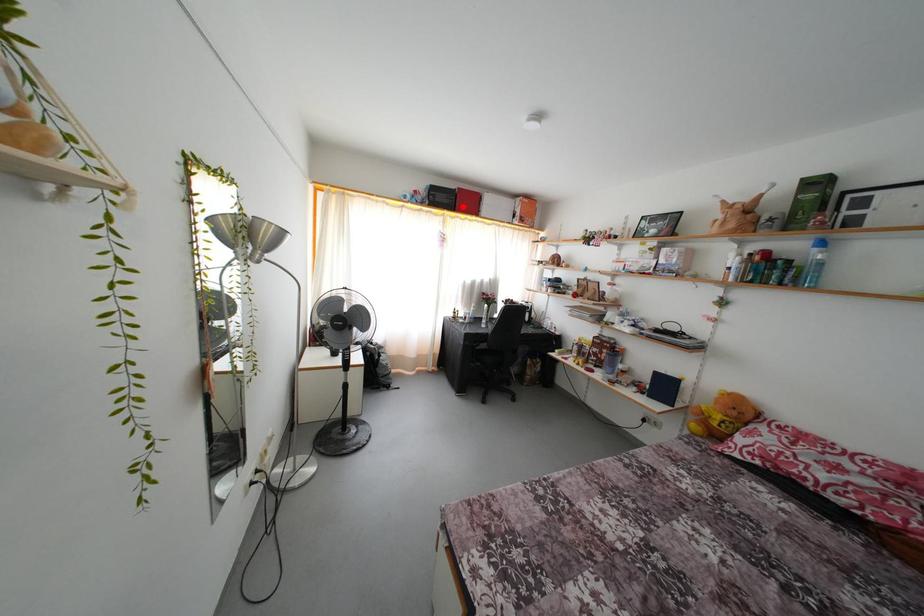
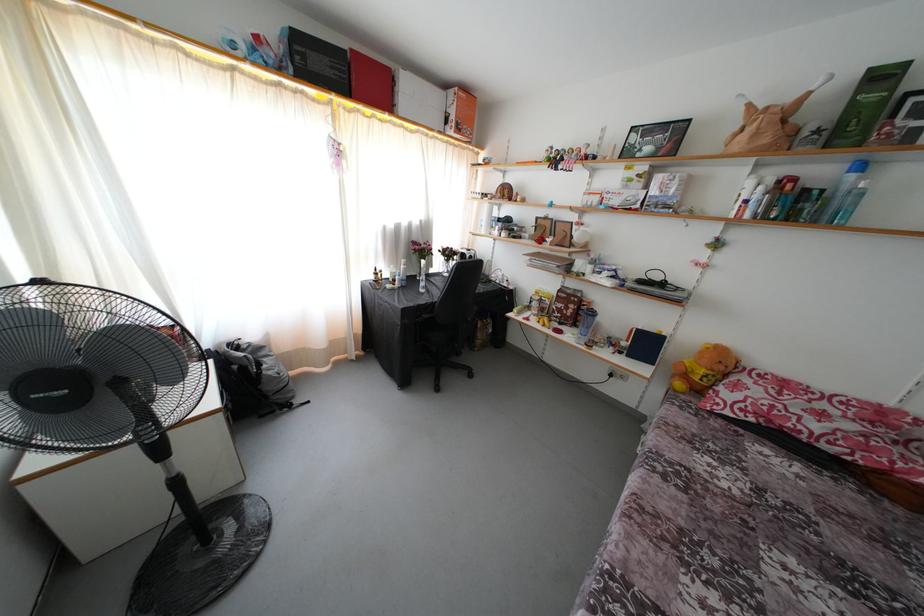
The point at the highlighted location is marked in the first image. Where is the corresponding point in the second image?

(359, 83)